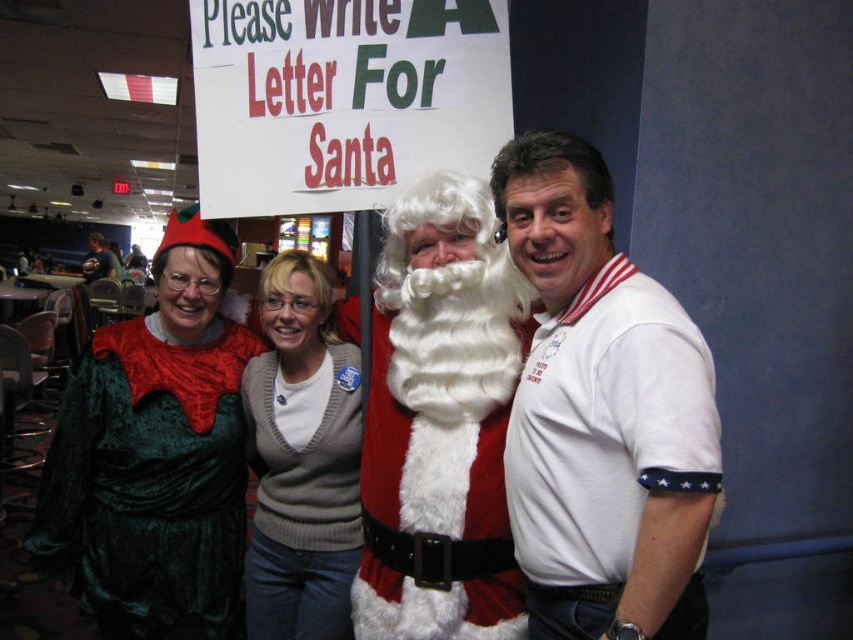
Question: Which object is farther from the camera taking this photo?

Choices:
 (A) knit sweater at center
 (B) velvet green dress at left

Answer: (A)

Question: Is white polo shirt at right bigger than velvet green dress at left?

Choices:
 (A) yes
 (B) no

Answer: (B)

Question: Which point appears closest to the camera in this image?

Choices:
 (A) (561, 582)
 (B) (479, 573)
 (C) (142, 632)

Answer: (A)

Question: Does white polo shirt at right appear on the left side of knit sweater at center?

Choices:
 (A) yes
 (B) no

Answer: (B)

Question: Which object appears closest to the camera in this image?

Choices:
 (A) white fluffy beard at center
 (B) velvet green dress at left
 (C) white polo shirt at right

Answer: (C)

Question: Can you confirm if white fluffy beard at center is smaller than velvet green dress at left?

Choices:
 (A) no
 (B) yes

Answer: (B)